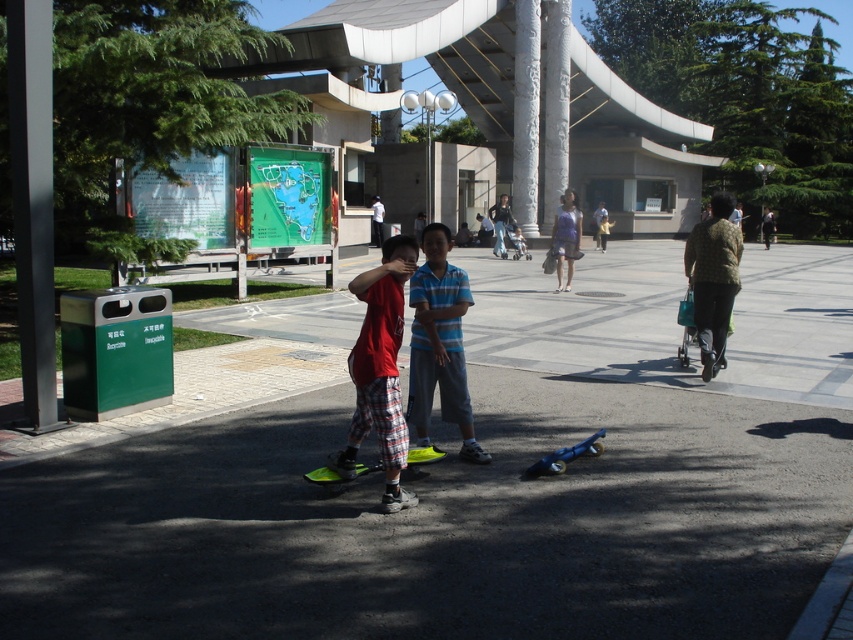
Is green textured sweater at right wider than green plastic skateboard at lower center?

Correct, the width of green textured sweater at right exceeds that of green plastic skateboard at lower center.

Can you confirm if green textured sweater at right is positioned below green plastic skateboard at lower center?

No.

Who is more distant from viewer, (717,253) or (320,483)?

The point (717,253) is behind.

The height and width of the screenshot is (640, 853). What are the coordinates of `green textured sweater at right` in the screenshot? It's located at (712, 278).

Which is behind, point (399, 273) or point (410, 465)?

The point (410, 465) is more distant.

Describe the element at coordinates (380, 369) in the screenshot. This screenshot has height=640, width=853. I see `red plaid shorts at center` at that location.

Locate an element on the screen. red plaid shorts at center is located at coordinates (380, 369).

Which is in front, point (451, 369) or point (498, 252)?

Point (451, 369)

Which of these two, blue striped shirt at center or dark blue jeans at center, stands taller?

Standing taller between the two is dark blue jeans at center.

Is point (459, 272) in front of point (495, 216)?

Yes.

Identify the location of blue striped shirt at center. (439, 342).